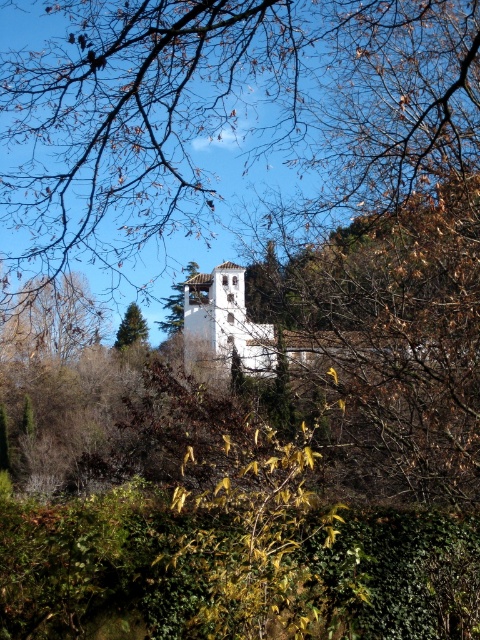
You are an architect planning to add a new pathway from the brown leafy tree at center to the white stucco bell tower at center. Based on their positions, in which direction should the pathway initially head from the tree to reach the tower?

The pathway should initially head to the left from the brown leafy tree at center because the white stucco bell tower at center is to the left of the tree.

In the scene shown: You are an architect analyzing the image of a white building surrounded by trees. You notice two structures labeled as the white stucco bell tower at center and the smooth white tower at center. Which of these two structures is bigger in size?

The white stucco bell tower at center is larger in size than the smooth white tower at center.